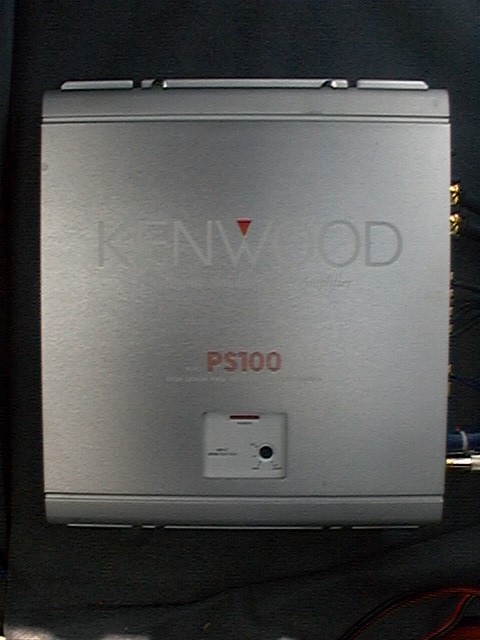
This screenshot has height=640, width=480. Find the location of `amplifier`. amplifier is located at coordinates (347, 310).